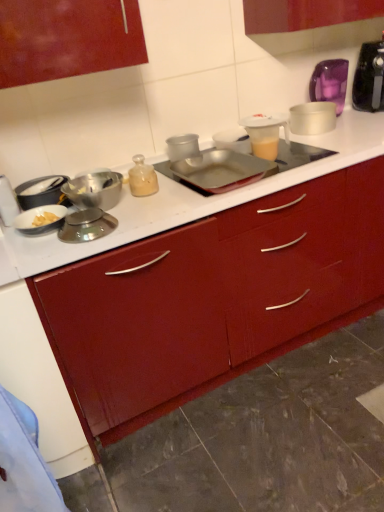
Find the location of `vacant area that is situated to the right of translucent plastic measuring cup at upper center, which is the first appliance in left-to-right order`. vacant area that is situated to the right of translucent plastic measuring cup at upper center, which is the first appliance in left-to-right order is located at coordinates (311, 156).